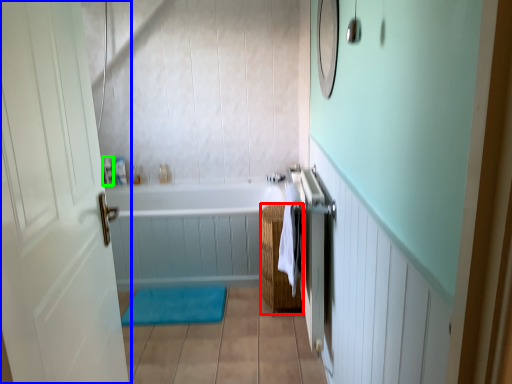
Question: Which is nearer to the basket (highlighted by a red box)? door (highlighted by a blue box) or toiletry (highlighted by a green box).

Choices:
 (A) door
 (B) toiletry

Answer: (A)